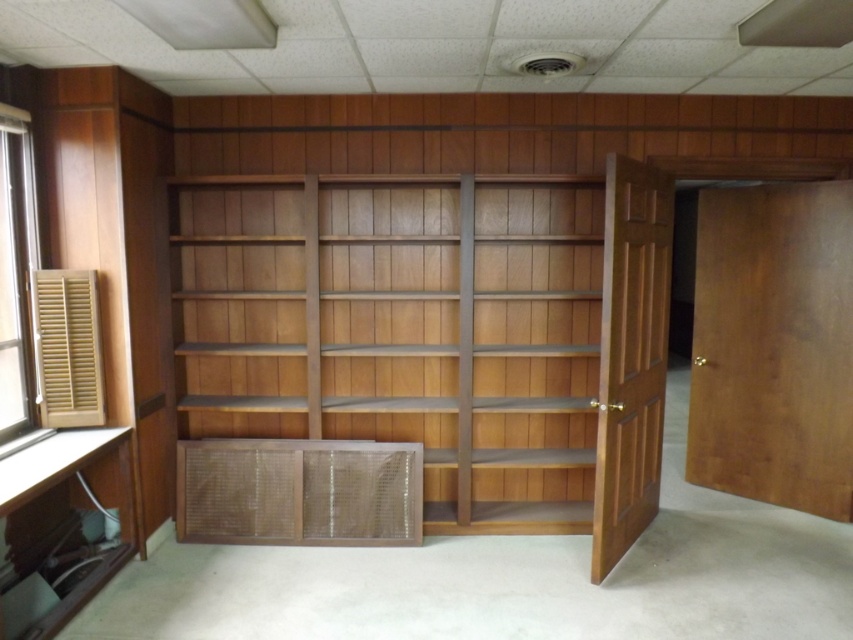
Between shiny brown wood bookshelf at center and wooden slatted window at left, which one is positioned higher?

wooden slatted window at left is above.

What do you see at coordinates (436, 330) in the screenshot? Image resolution: width=853 pixels, height=640 pixels. I see `shiny brown wood bookshelf at center` at bounding box center [436, 330].

This screenshot has width=853, height=640. Find the location of `shiny brown wood bookshelf at center`. shiny brown wood bookshelf at center is located at coordinates (436, 330).